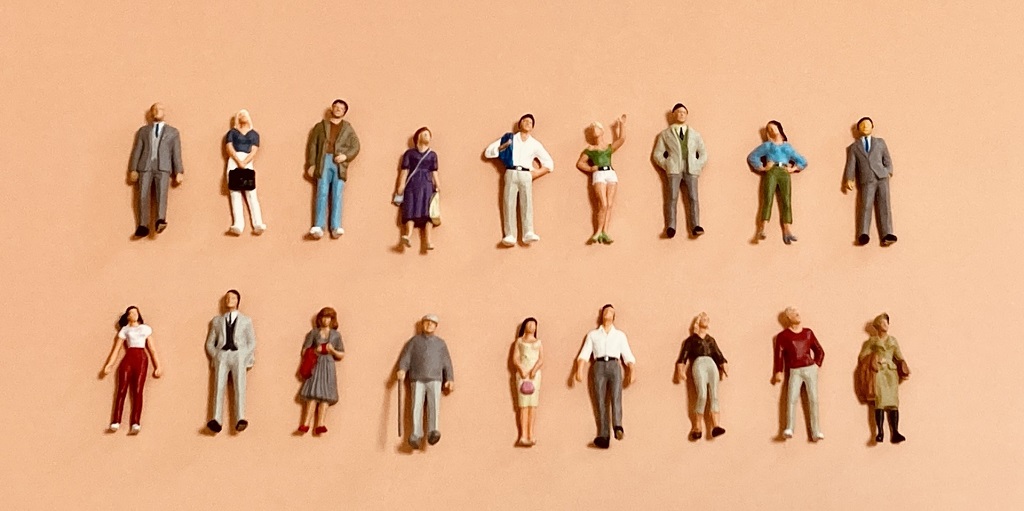
Locate an element on the screen. The image size is (1024, 511). figurines of men is located at coordinates (144, 165), (324, 154), (518, 155), (676, 150), (855, 167), (802, 366), (605, 369), (427, 366), (228, 351).